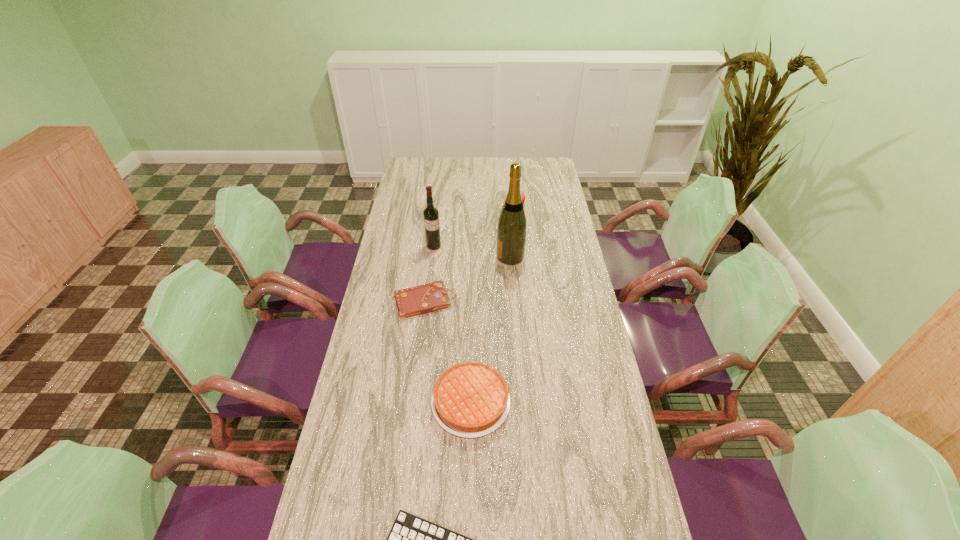
The image size is (960, 540). Identify the location of free space that satisfies the following two spatial constraints: 1. on the back side of the fourth farthest object; 2. on the left side of the third tallest object. (437, 205).

Where is `blank area in the image that satisfies the following two spatial constraints: 1. on the front side of the farthest object; 2. on the front-facing side of the tallest object`? This screenshot has height=540, width=960. blank area in the image that satisfies the following two spatial constraints: 1. on the front side of the farthest object; 2. on the front-facing side of the tallest object is located at coordinates (521, 256).